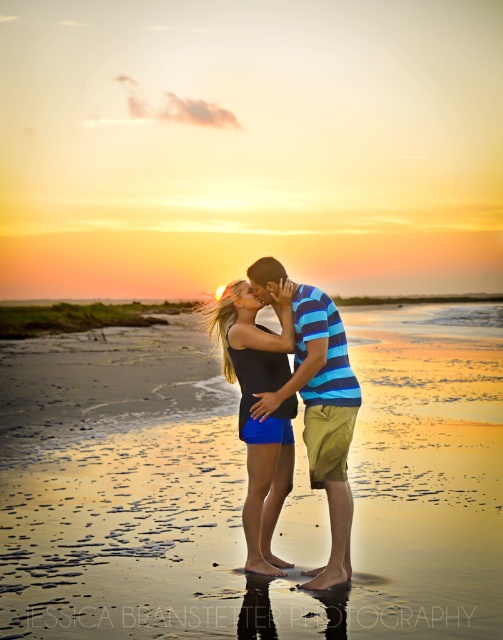
You are a GUI agent. You are given a task and a screenshot of the screen. Output one action in this format:
    pyautogui.click(x=<x>, y=<y>)
    Task: Click on the sandy beach at center
    The height and width of the screenshot is (640, 503).
    Given the screenshot: What is the action you would take?
    pyautogui.click(x=244, y=486)

Which is behind, point (321, 372) or point (277, 451)?

The point (277, 451) is more distant.

Based on the photo, which is more to the left, striped cotton shirt at center or matte black tank top at center?

matte black tank top at center is more to the left.

The height and width of the screenshot is (640, 503). Identify the location of striped cotton shirt at center. (322, 419).

Is sandy beach at center shorter than striped cotton shirt at center?

Yes.

Is sandy beach at center positioned before striped cotton shirt at center?

Yes, it is in front of striped cotton shirt at center.

Identify the location of sandy beach at center. (x=244, y=486).

In order to click on sandy beach at center in this screenshot , I will do `click(244, 486)`.